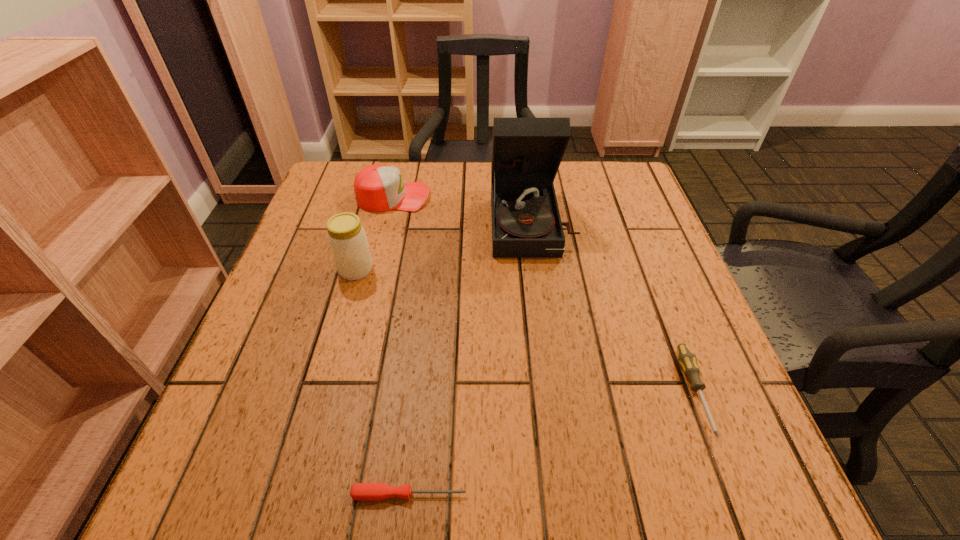
You are a GUI agent. You are given a task and a screenshot of the screen. Output one action in this format:
    pyautogui.click(x=<x>, y=<y>)
    Task: Click on the tallest object
    This screenshot has width=960, height=540.
    Given the screenshot: What is the action you would take?
    pyautogui.click(x=526, y=152)

At what (x,y) coordinates should I click in order to perform the action: click on phonograph_record. Please return your answer as a coordinate pair (x, y). This screenshot has height=540, width=960. Looking at the image, I should click on (526, 152).

This screenshot has height=540, width=960. What are the coordinates of `the third nearest object` in the screenshot? It's located at (347, 239).

I want to click on jar, so (x=347, y=239).

At what (x,y) coordinates should I click in order to perform the action: click on baseball cap. Please return your answer as a coordinate pair (x, y). Image resolution: width=960 pixels, height=540 pixels. Looking at the image, I should click on (378, 188).

Image resolution: width=960 pixels, height=540 pixels. What are the coordinates of `the second nearest object` in the screenshot? It's located at (686, 358).

This screenshot has width=960, height=540. I want to click on the farther screwdriver, so click(x=686, y=358).

Locate an element on the screen. The width and height of the screenshot is (960, 540). the nearest object is located at coordinates (359, 491).

You are a GUI agent. You are given a task and a screenshot of the screen. Output one action in this format:
    pyautogui.click(x=<x>, y=<y>)
    Task: Click on the nearer screwdriver
    The height and width of the screenshot is (540, 960).
    Given the screenshot: What is the action you would take?
    pyautogui.click(x=359, y=491)

Identify the location of free point located 0.340m on the front-facing side of the phonograph_record. The width and height of the screenshot is (960, 540). (556, 394).